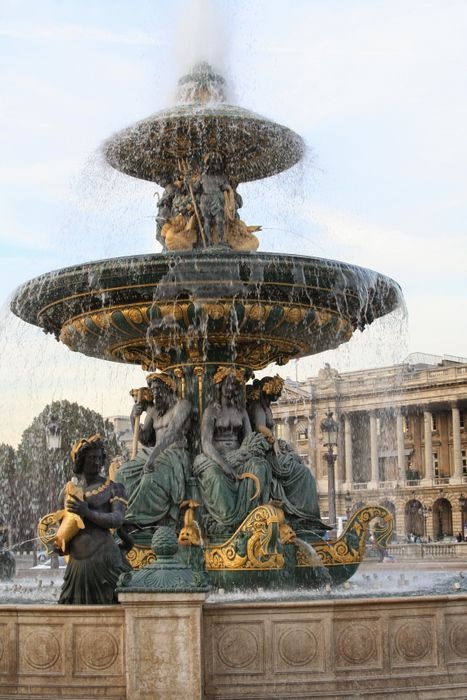
You are a GUI agent. You are given a task and a screenshot of the screen. Output one action in this format:
    pyautogui.click(x=<x>, y=<y>)
    Task: Click on the wall
    
    Given the screenshot: What is the action you would take?
    pyautogui.click(x=238, y=659), pyautogui.click(x=104, y=664), pyautogui.click(x=179, y=668)